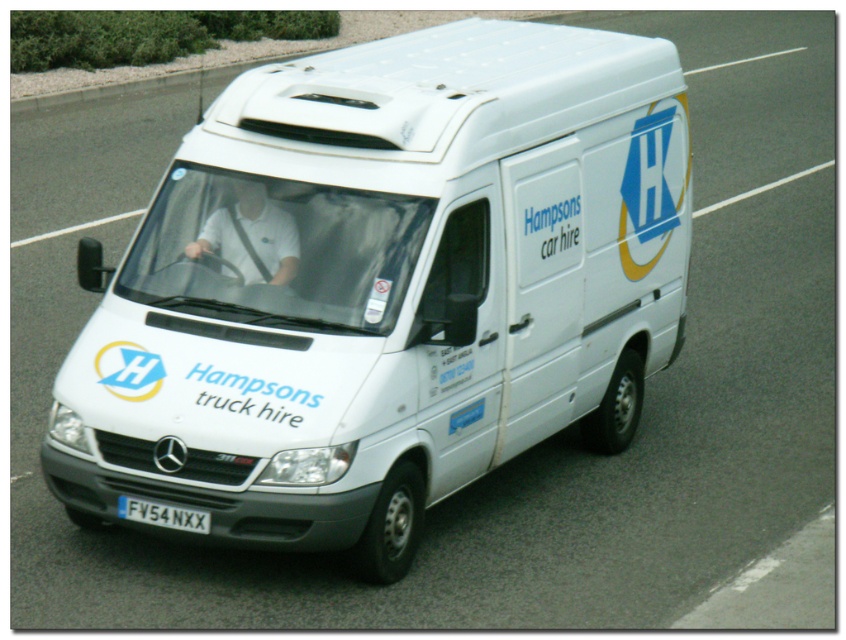
Question: Where is white matte van at center located in relation to white plastic license plate at center in the image?

Choices:
 (A) above
 (B) below

Answer: (A)

Question: Can you confirm if white matte van at center is positioned above white plastic license plate at center?

Choices:
 (A) no
 (B) yes

Answer: (B)

Question: Is white matte van at center to the left of white plastic license plate at center from the viewer's perspective?

Choices:
 (A) no
 (B) yes

Answer: (A)

Question: Which object is farther from the camera taking this photo?

Choices:
 (A) white plastic license plate at center
 (B) white matte van at center

Answer: (A)

Question: Which of the following is the closest to the observer?

Choices:
 (A) (235, 461)
 (B) (139, 512)

Answer: (A)

Question: Among these objects, which one is nearest to the camera?

Choices:
 (A) white plastic license plate at center
 (B) white matte van at center

Answer: (B)